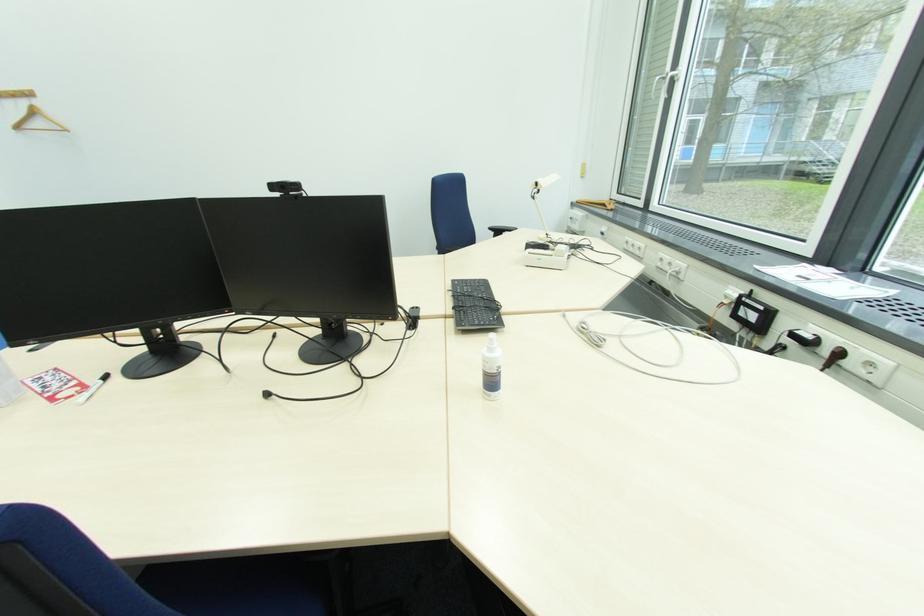
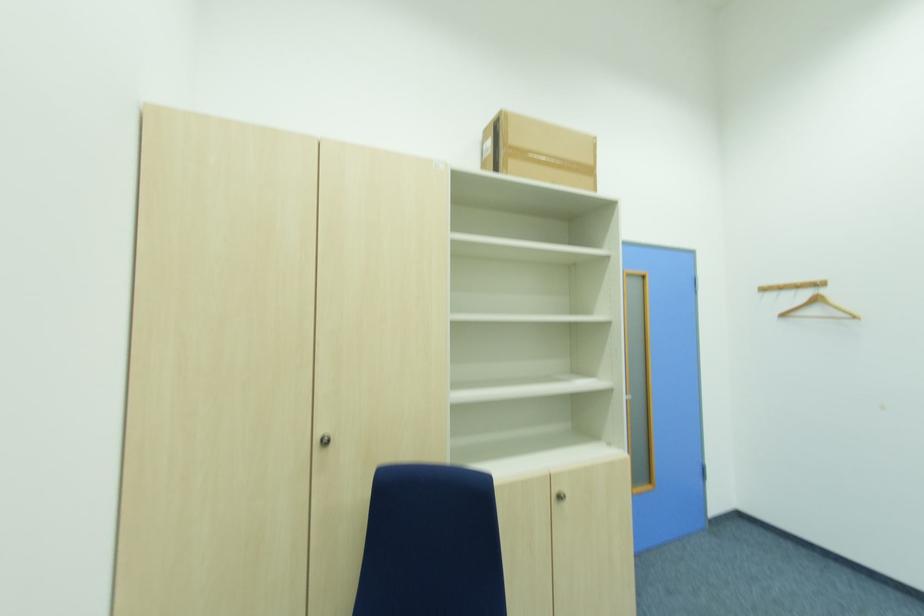
Find the pixel in the second image that matches (29,105) in the first image.

(809, 296)